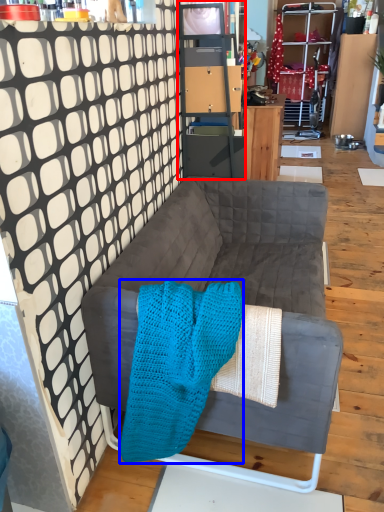
Question: Which point is closer to the camera, cabinetry (highlighted by a red box) or blanket (highlighted by a blue box)?

Choices:
 (A) cabinetry
 (B) blanket

Answer: (B)